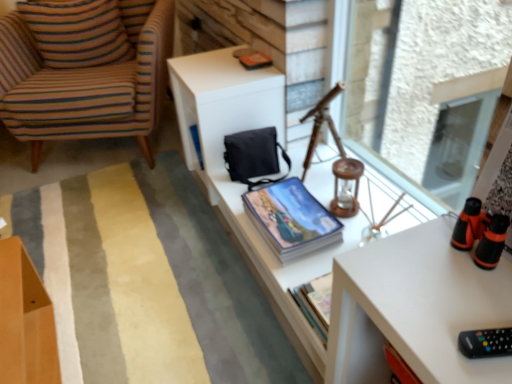
Question: Does striped fabric armchair at left turn towards soft striped rug at center?

Choices:
 (A) no
 (B) yes

Answer: (B)

Question: Is soft striped rug at center at the back of striped fabric armchair at left?

Choices:
 (A) no
 (B) yes

Answer: (A)

Question: Is striped fabric armchair at left at the right side of soft striped rug at center?

Choices:
 (A) no
 (B) yes

Answer: (A)

Question: Is striped fabric armchair at left shorter than soft striped rug at center?

Choices:
 (A) no
 (B) yes

Answer: (A)

Question: Is striped fabric armchair at left wider than soft striped rug at center?

Choices:
 (A) no
 (B) yes

Answer: (A)

Question: Can soft striped rug at center be found inside striped fabric armchair at left?

Choices:
 (A) yes
 (B) no

Answer: (B)

Question: From the image's perspective, would you say white matte table at center is shown under soft striped rug at center?

Choices:
 (A) no
 (B) yes

Answer: (A)

Question: Is white matte table at center behind soft striped rug at center?

Choices:
 (A) yes
 (B) no

Answer: (B)

Question: Does white matte table at center have a lesser width compared to soft striped rug at center?

Choices:
 (A) no
 (B) yes

Answer: (B)

Question: Is white matte table at center positioned before soft striped rug at center?

Choices:
 (A) yes
 (B) no

Answer: (A)

Question: Is white matte table at center not within soft striped rug at center?

Choices:
 (A) no
 (B) yes

Answer: (B)

Question: Would you say white matte table at center is a long distance from soft striped rug at center?

Choices:
 (A) no
 (B) yes

Answer: (A)

Question: Can you confirm if matte blue magazine at upper center is shorter than transparent glass window screen at upper right?

Choices:
 (A) no
 (B) yes

Answer: (B)